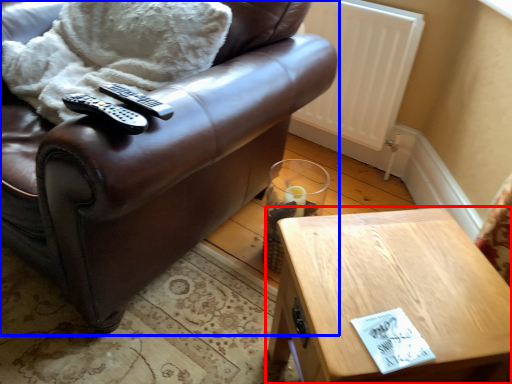
Question: Which point is further to the camera, table (highlighted by a red box) or chair (highlighted by a blue box)?

Choices:
 (A) table
 (B) chair

Answer: (A)